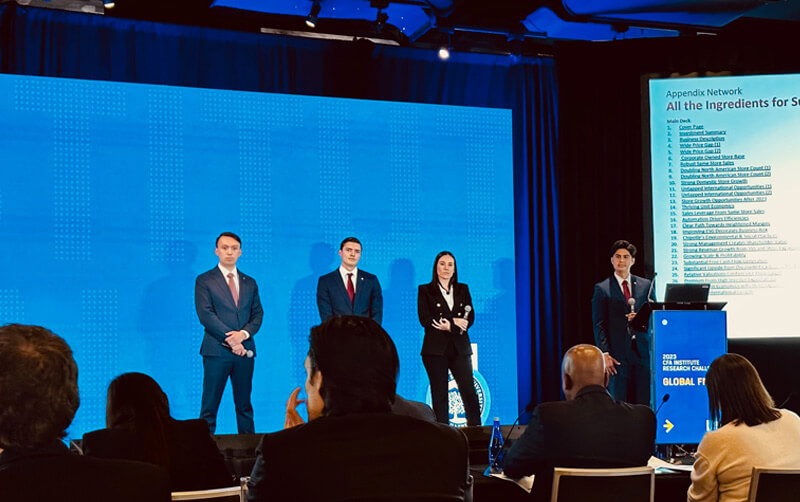
Locate an element on the screen. The image size is (800, 502). chair is located at coordinates (618, 483), (778, 495), (224, 494).